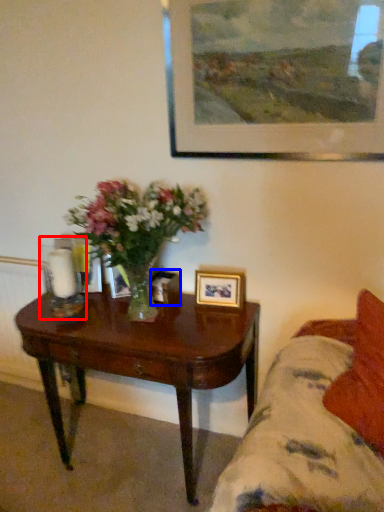
Question: Which object is closer to the camera taking this photo, candle holder (highlighted by a red box) or picture frame (highlighted by a blue box)?

Choices:
 (A) candle holder
 (B) picture frame

Answer: (A)